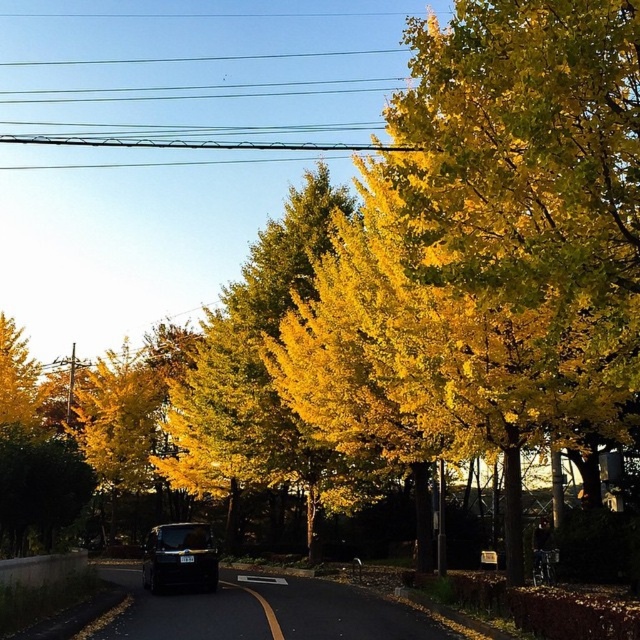
You are driving a car and see the yellow leafy tree at center and the shiny black van at center ahead on the road. Which object takes up more space horizontally from your viewpoint?

The yellow leafy tree at center takes up more space horizontally than the shiny black van at center because its width is larger.

You are driving a car and see the yellow leafy tree at center and the shiny black van at center ahead on the road. Which object is closer to you?

The yellow leafy tree at center is closer to you because it is further to the viewer than the shiny black van at center.

You are a pedestrian standing at the edge of the road. You see a yellow leafy tree at center and a shiny black van at center. Which object is bigger in size?

The yellow leafy tree at center is larger in size compared to the shiny black van at center.